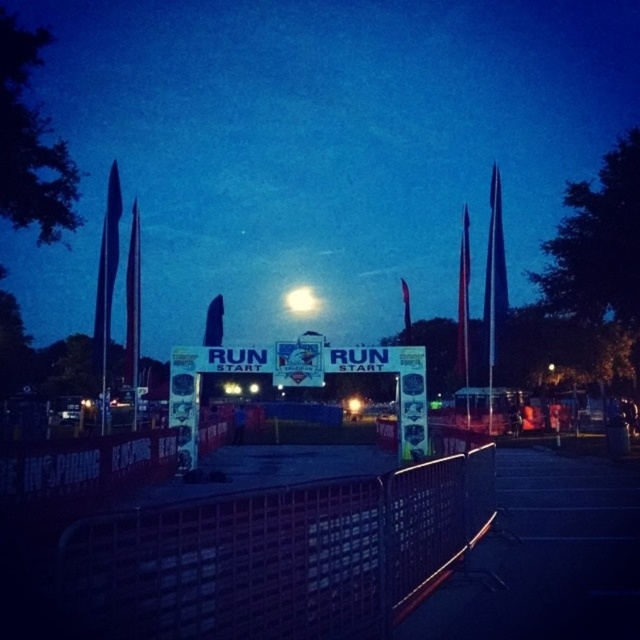
You are a runner preparing to start a race and see the white paper sign at center and the bright white orb at center in the distance. Which object is nearer to you as you stand at the starting line?

The white paper sign at center is closer to the viewer than the bright white orb at center, so the white paper sign at center is nearer to you.

You are a runner preparing to start a race at night. You see the metallic mesh fence at center and the bright white orb at center. Which object is closer to you as you stand at the starting line?

The metallic mesh fence at center is closer to you than the bright white orb at center because they are 74.54 meters apart.